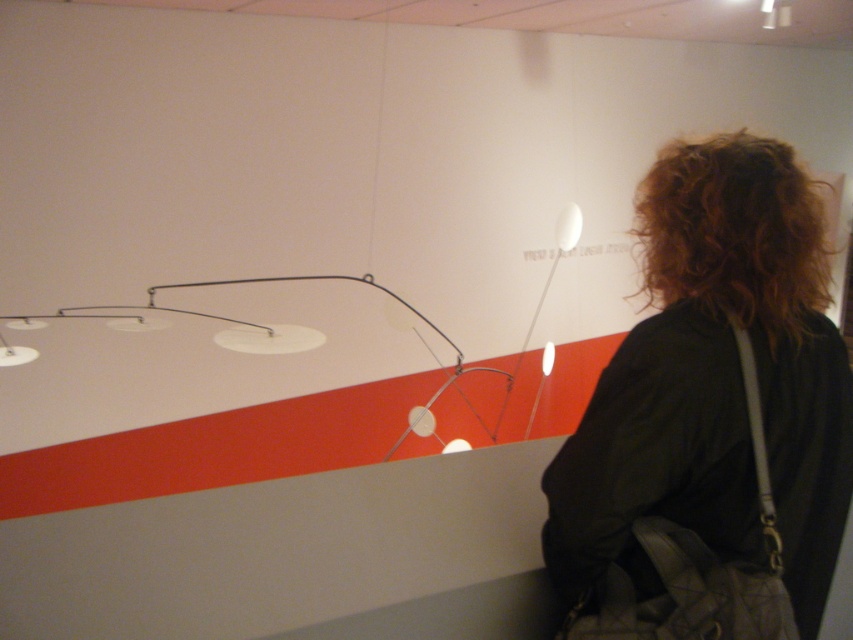
Consider the image. You are an art critic analyzing the positioning of elements in the image. The dark brown hair at upper right is represented by point (x=715, y=381). Is this point located in the upper half of the image?

The dark brown hair at upper right is represented by point (x=715, y=381). Since the y coordinate is 0.839, which is greater than 0.5, the point is located in the upper half of the image.

You are a photographer positioned at the camera. You want to capture a closeup shot of the dark brown hair at upper right without moving the subject. Can you adjust your camera zoom to achieve this? The camera has a maximum zoom range of 40 inches. Please state your answer and explain.

The dark brown hair at upper right is 38.67 inches away from the camera. Since the camera can zoom up to 40 inches, adjusting the zoom to its maximum capacity would allow capturing a closeup of the dark brown hair at upper right without moving the subject.